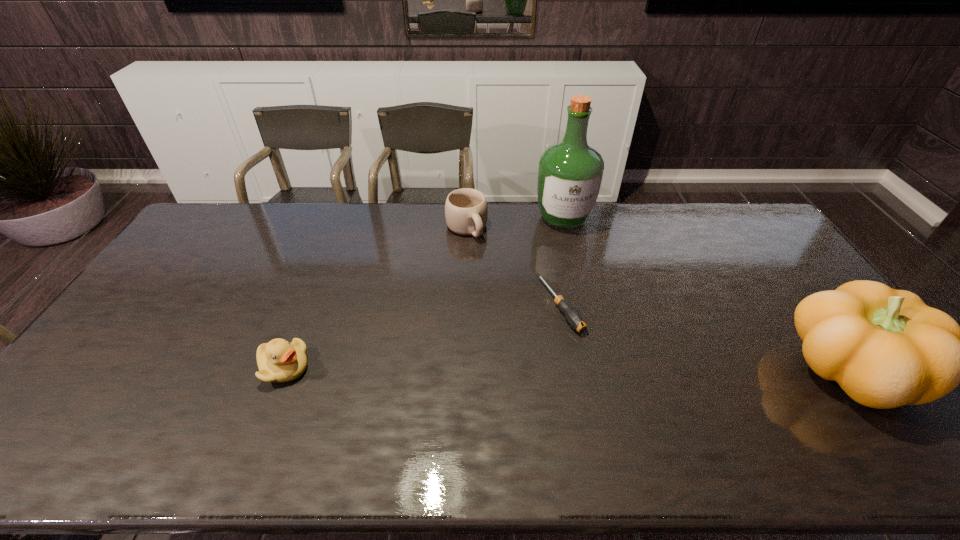
The width and height of the screenshot is (960, 540). In order to click on pumpkin that is at the near edge in this screenshot , I will do `click(886, 348)`.

Where is `object positioned at the right edge`? object positioned at the right edge is located at coordinates (886, 348).

At what (x,y) coordinates should I click in order to perform the action: click on object that is at the near right corner. Please return your answer as a coordinate pair (x, y). The image size is (960, 540). Looking at the image, I should click on (886, 348).

In the image, there is a desktop. Identify the location of free space at the far edge. Image resolution: width=960 pixels, height=540 pixels. (318, 202).

This screenshot has height=540, width=960. I want to click on vacant space at the near edge of the desktop, so click(819, 409).

Identify the location of free region at the left edge. The width and height of the screenshot is (960, 540). (170, 314).

Image resolution: width=960 pixels, height=540 pixels. Find the location of `vacant space at the right edge of the desktop`. vacant space at the right edge of the desktop is located at coordinates (800, 290).

At what (x,y) coordinates should I click in order to perform the action: click on vacant space at the far left corner. Please return your answer as a coordinate pair (x, y). Looking at the image, I should click on coord(208,235).

Find the location of `free space between the screwdriver and the liquor`. free space between the screwdriver and the liquor is located at coordinates (562, 262).

You are a GUI agent. You are given a task and a screenshot of the screen. Output one action in this format:
    pyautogui.click(x=<x>, y=<y>)
    Task: Click on the free area in between the duckling and the tallest object
    This screenshot has height=540, width=960.
    Given the screenshot: What is the action you would take?
    pyautogui.click(x=423, y=293)